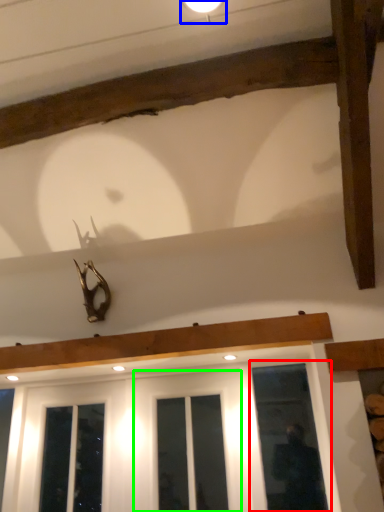
Question: Estimate the real-world distances between objects in this image. Which object is closer to window (highlighted by a red box), light fixture (highlighted by a blue box) or screen door (highlighted by a green box)?

Choices:
 (A) light fixture
 (B) screen door

Answer: (B)